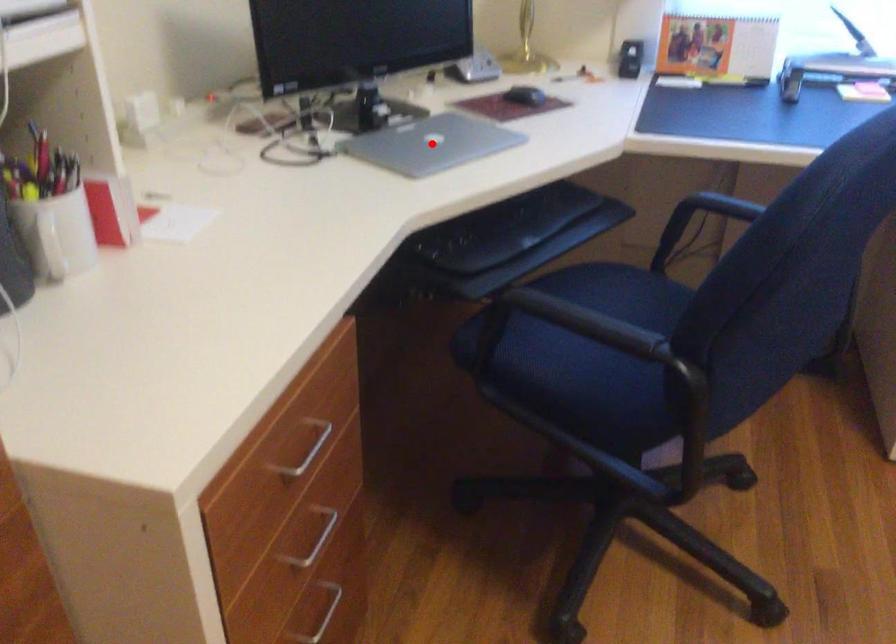
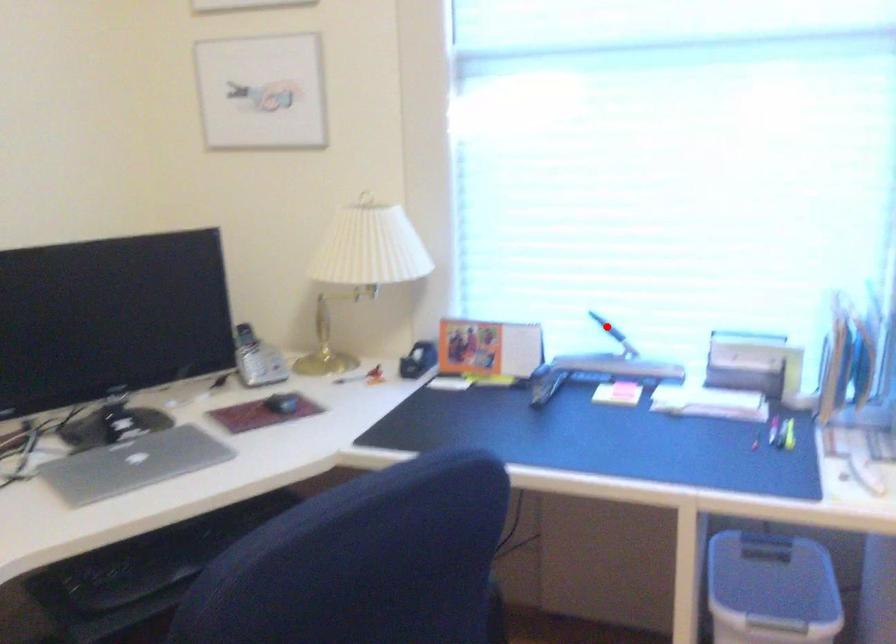
I am providing you with two images of the same scene from different viewpoints. A red point is marked on the first image and another point is marked on the second image. Is the red point in image1 aligned with the point shown in image2?

No